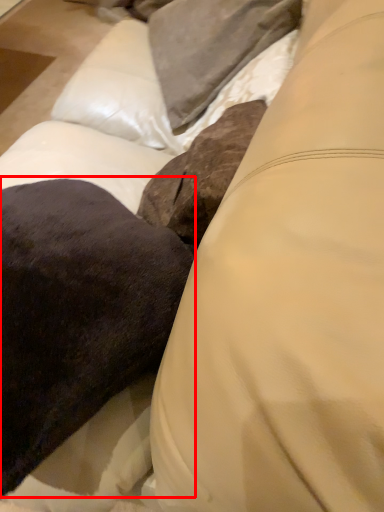
Question: From the image's perspective, where is throw pillow (annotated by the red box) located relative to pillow?

Choices:
 (A) below
 (B) above

Answer: (A)